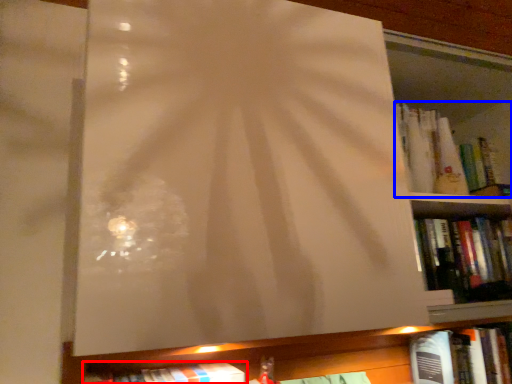
Question: Which object is closer to the camera taking this photo, book (highlighted by a red box) or book (highlighted by a blue box)?

Choices:
 (A) book
 (B) book

Answer: (A)